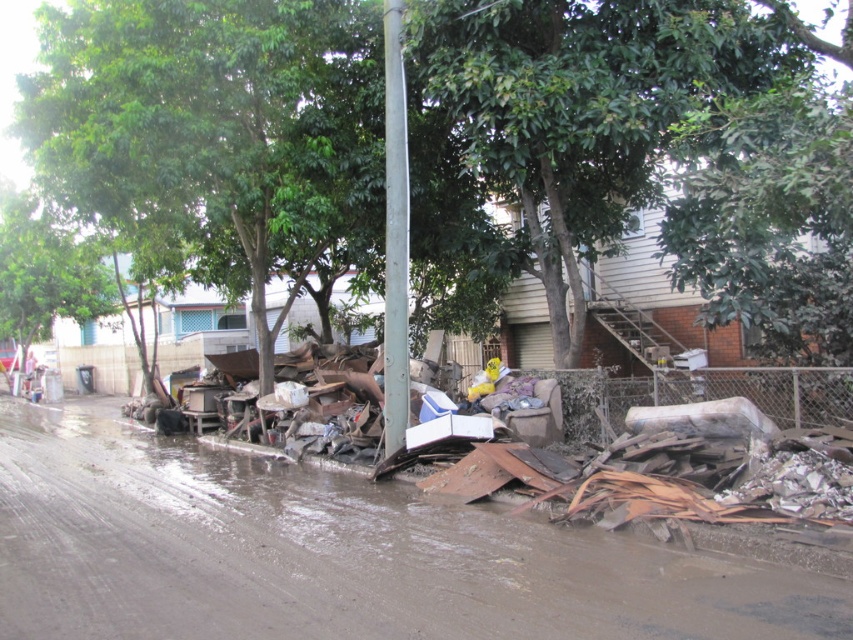
Does rusty metal debris at lower right come behind metallic gray pole at center?

No, it is not.

Looking at this image, can you confirm if rusty metal debris at lower right is positioned to the right of metallic gray pole at center?

Incorrect, rusty metal debris at lower right is not on the right side of metallic gray pole at center.

At what (x,y) coordinates should I click in order to perform the action: click on rusty metal debris at lower right. Please return your answer as a coordinate pair (x, y). The image size is (853, 640). Looking at the image, I should click on pyautogui.click(x=334, y=554).

You are a GUI agent. You are given a task and a screenshot of the screen. Output one action in this format:
    pyautogui.click(x=<x>, y=<y>)
    Task: Click on the rusty metal debris at lower right
    This screenshot has height=640, width=853.
    Given the screenshot: What is the action you would take?
    pyautogui.click(x=334, y=554)

Who is lower down, green leafy tree at center or metallic gray pole at center?

Positioned lower is metallic gray pole at center.

What do you see at coordinates (207, 132) in the screenshot? I see `green leafy tree at center` at bounding box center [207, 132].

Is point (120, 198) positioned in front of point (390, 13)?

That is False.

The height and width of the screenshot is (640, 853). Identify the location of green leafy tree at center. (207, 132).

Does rusty metal debris at lower right come behind green leafy tree at center?

No, it is in front of green leafy tree at center.

Does point (474, 630) come behind point (206, 225)?

No, (474, 630) is in front of (206, 225).

At what (x,y) coordinates should I click in order to perform the action: click on rusty metal debris at lower right. Please return your answer as a coordinate pair (x, y). The height and width of the screenshot is (640, 853). Looking at the image, I should click on (334, 554).